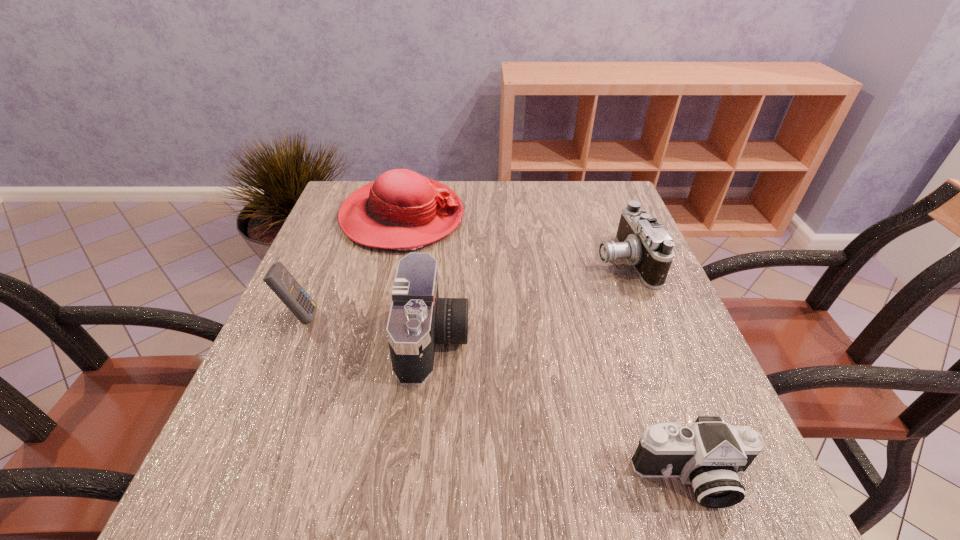
In the image, there is a desktop. At what (x,y) coordinates should I click in order to perform the action: click on free space at the left edge. Please return your answer as a coordinate pair (x, y). Image resolution: width=960 pixels, height=540 pixels. Looking at the image, I should click on (x=290, y=465).

Find the location of a particular element. vacant space at the right edge of the desktop is located at coordinates (607, 286).

Where is `vacant area at the far left corner of the desktop`? This screenshot has height=540, width=960. vacant area at the far left corner of the desktop is located at coordinates (328, 215).

The image size is (960, 540). Identify the location of blank space at the near left corner of the desktop. (269, 503).

Image resolution: width=960 pixels, height=540 pixels. Find the location of `vacant area at the near right corner of the desktop`. vacant area at the near right corner of the desktop is located at coordinates (738, 531).

At what (x,y) coordinates should I click in order to perform the action: click on free space between the nearest camera and the farthest camera. Please return your answer as a coordinate pair (x, y). The width and height of the screenshot is (960, 540). Looking at the image, I should click on click(x=658, y=369).

This screenshot has width=960, height=540. In order to click on vacant area that lies between the nearest camera and the hat in this screenshot , I will do `click(546, 347)`.

This screenshot has width=960, height=540. Identify the location of empty space between the leftmost camera and the nearest object. (563, 409).

Image resolution: width=960 pixels, height=540 pixels. I want to click on vacant point located between the farthest camera and the hat, so click(x=513, y=239).

Identify the location of unoccupied position between the nearest object and the second nearest camera. This screenshot has height=540, width=960. (563, 409).